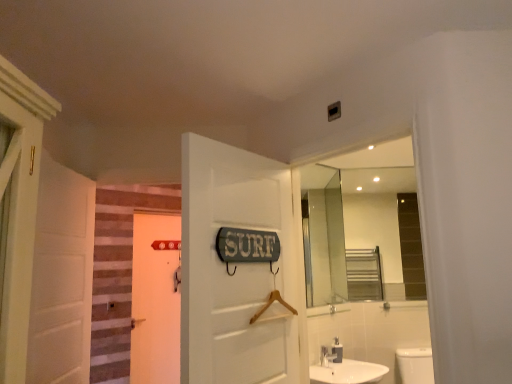
Question: In terms of size, does white matte door at left, arranged as the second door when viewed from the back, appear bigger or smaller than white matte door at center, which is the 3th door in front-to-back order?

Choices:
 (A) big
 (B) small

Answer: (A)

Question: From the image's perspective, relative to white matte door at center, the second door when ordered from right to left, is white matte door at left, the 2th door from the front, above or below?

Choices:
 (A) below
 (B) above

Answer: (B)

Question: Which of these objects is positioned farthest from the white matte door at left, the 2th door from the front?

Choices:
 (A) white glossy sink at lower center
 (B) brown striped carpet at left
 (C) metallic silver soap dispenser at lower center
 (D) green painted wood door at center, which appears as the first door when viewed from the front
 (E) white matte door at center, which ranks as the second door in left-to-right order

Answer: (E)

Question: Which is nearer to the white glossy sink at lower center?

Choices:
 (A) brown striped carpet at left
 (B) white matte door at left, the 3th door in the right-to-left sequence
 (C) metallic silver soap dispenser at lower center
 (D) white matte door at center, which ranks as the second door in left-to-right order
 (E) green painted wood door at center, which is counted as the third door, starting from the left

Answer: (C)